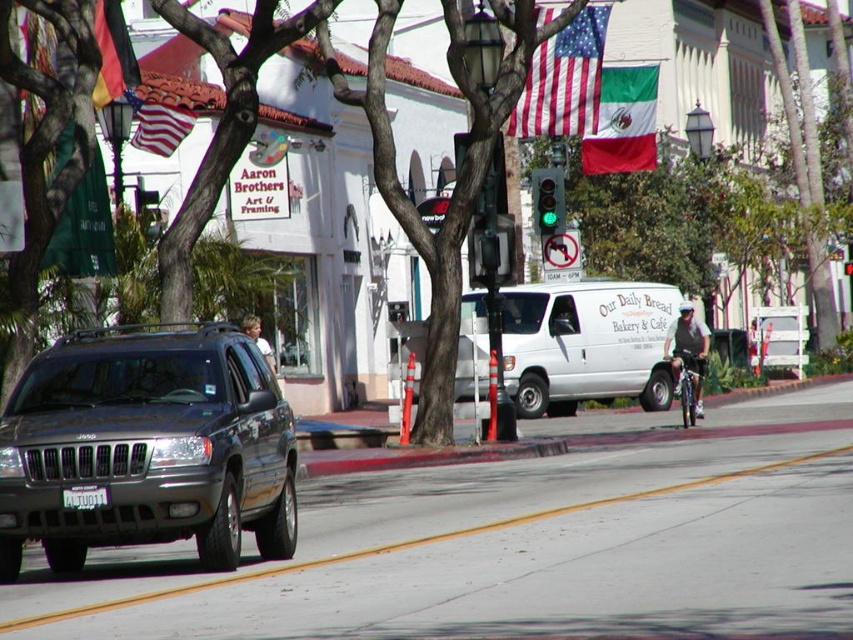
Is red fabric flag at upper left further to the viewer compared to white plastic license plate at center?

Yes, it is.

The width and height of the screenshot is (853, 640). What do you see at coordinates (112, 52) in the screenshot? I see `red fabric flag at upper left` at bounding box center [112, 52].

Locate an element on the screen. red fabric flag at upper left is located at coordinates (112, 52).

Describe the element at coordinates (160, 128) in the screenshot. I see `american flag at upper left` at that location.

Image resolution: width=853 pixels, height=640 pixels. Find the location of `american flag at upper left`. american flag at upper left is located at coordinates (160, 128).

Locate an element on the screen. This screenshot has height=640, width=853. american flag at upper left is located at coordinates (160, 128).

Is metallic gray suv at left to the right of red fabric flag at upper left from the viewer's perspective?

Correct, you'll find metallic gray suv at left to the right of red fabric flag at upper left.

Does point (206, 532) come in front of point (126, 80)?

That is True.

Does point (268, 445) come farther from viewer compared to point (125, 90)?

No, it is not.

In order to click on metallic gray suv at left in this screenshot , I will do `click(148, 445)`.